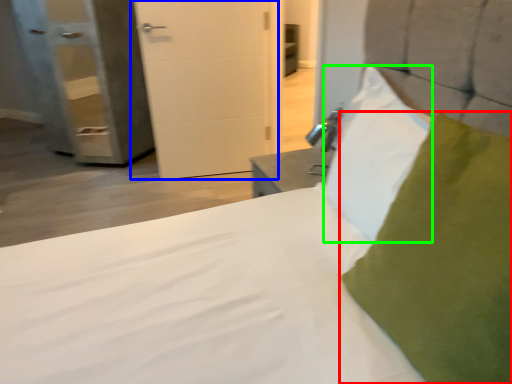
Question: Estimate the real-world distances between objects in this image. Which object is closer to pillow (highlighted by a red box), door (highlighted by a blue box) or pillow (highlighted by a green box)?

Choices:
 (A) door
 (B) pillow

Answer: (B)